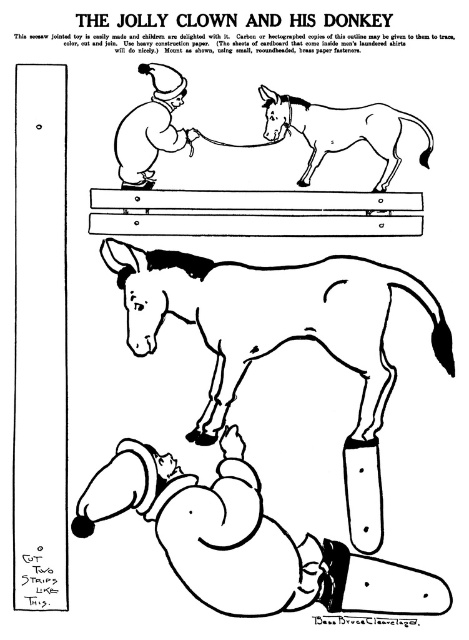
Question: Which point is closer to the camera?

Choices:
 (A) (160, 116)
 (B) (403, 116)
 (C) (367, 456)

Answer: (B)

Question: Is smooth wood plank at center above matte black clown at upper left?

Choices:
 (A) no
 (B) yes

Answer: (A)

Question: Is smooth wood plank at center bigger than matte black clown at upper left?

Choices:
 (A) yes
 (B) no

Answer: (A)

Question: Which point is closer to the camera taking this photo?

Choices:
 (A) (353, 116)
 (B) (337, 301)
 (C) (160, 122)
 (D) (346, 218)

Answer: (B)

Question: Is white paper horse at lower center to the right of brown paper donkey at upper center from the viewer's perspective?

Choices:
 (A) no
 (B) yes

Answer: (A)

Question: Which point appears farthest from the camera in this image?

Choices:
 (A) (272, 124)
 (B) (423, 301)

Answer: (A)